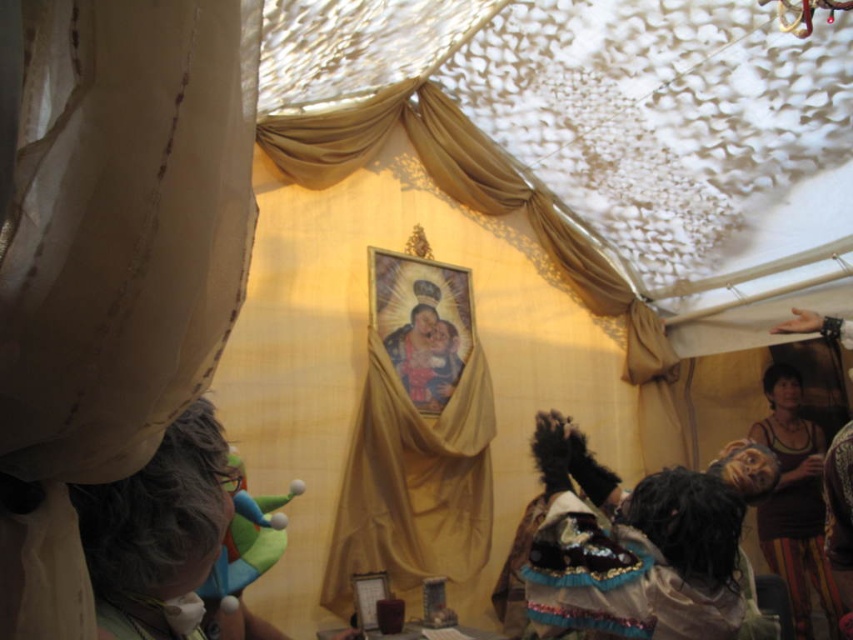
Question: Is gold satin curtain at center wider than black fabric at right?

Choices:
 (A) yes
 (B) no

Answer: (A)

Question: Can you confirm if translucent beige curtain at left is wider than gold satin curtain at center?

Choices:
 (A) no
 (B) yes

Answer: (A)

Question: Based on their relative distances, which object is nearer to the gold satin curtain at center?

Choices:
 (A) black fabric at right
 (B) translucent beige curtain at left

Answer: (A)

Question: Based on their relative distances, which object is nearer to the black fabric at right?

Choices:
 (A) gold satin curtain at center
 (B) translucent beige curtain at left

Answer: (A)

Question: Which point appears closest to the camera in this image?

Choices:
 (A) (459, 520)
 (B) (798, 611)

Answer: (B)

Question: Does translucent beige curtain at left have a larger size compared to gold satin curtain at center?

Choices:
 (A) yes
 (B) no

Answer: (B)